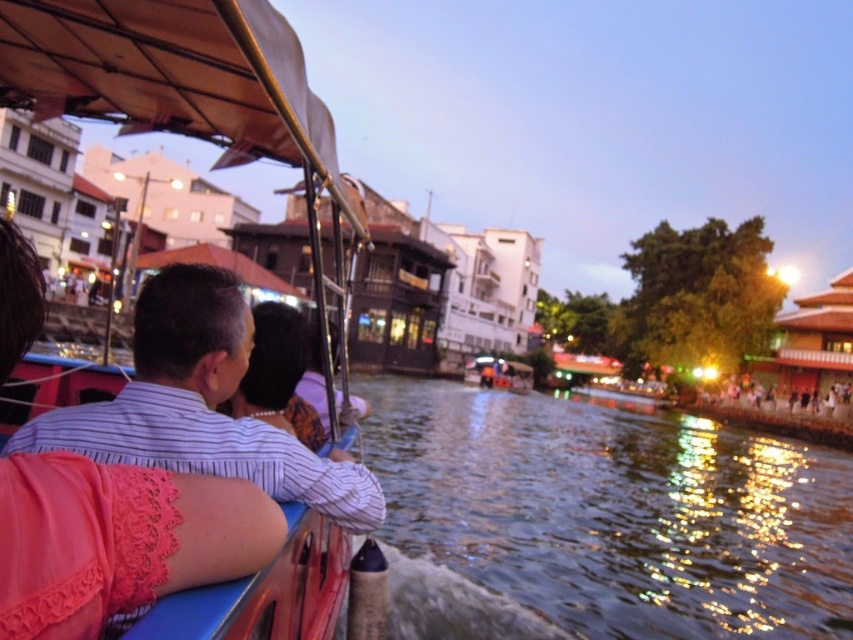
You are planning to take a boat ride and want to choose between the wooden boat at center and the matte black boat at right. Based on the scene, which boat is larger?

The matte black boat at right is larger than the wooden boat at center.

From the picture: You are a photographer on the boat and want to capture a wide shot of the scene. Since the dark water at center and the striped fabric shirt at center are both in your viewfinder, which object will appear wider in the photo?

The dark water at center will appear wider in the photo because its width surpasses that of the striped fabric shirt at center according to the description.

You are standing on the boat and want to move from the point closer to the front of the boat to the point near the back. Which direction should you walk? The two points are point (828, 461) and point (175, 116).

Since point (828, 461) is behind point (175, 116), you should walk towards the back of the boat to reach point (828, 461) from the front point (175, 116).